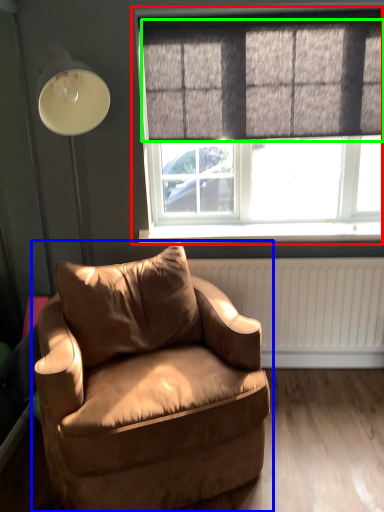
Question: Based on their relative distances, which object is nearer to window (highlighted by a red box)? Choose from chair (highlighted by a blue box) and curtain (highlighted by a green box).

Choices:
 (A) chair
 (B) curtain

Answer: (B)